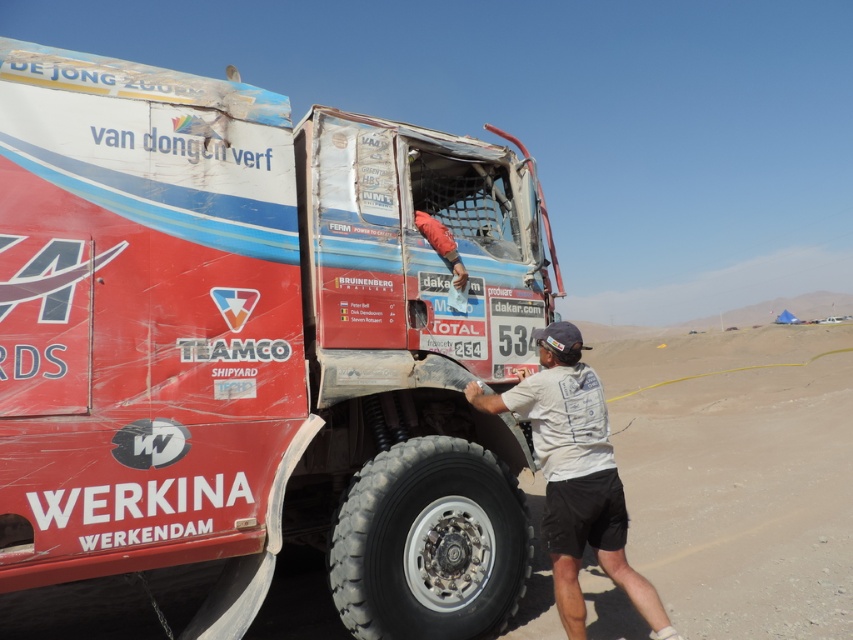
You are a photographer standing at the point with coordinates (257, 344). You want to capture a clear photo of the scratched red truck at center. Is your current position suitable for taking the photo?

The point at coordinates (257, 344) indicates the scratched red truck at center, so yes, your current position is suitable for taking a clear photo of the scratched red truck at center.

You are a photographer trying to capture a wide shot of the white cotton shirt at center and the black rubber tire at lower center. Given that the tire is wider than the shirt, which object should you focus on first to ensure both are in frame without moving the camera?

Since the black rubber tire at lower center is wider than the white cotton shirt at center, you should focus on the black rubber tire at lower center first to ensure it fits within the frame, as its larger width requires more space.